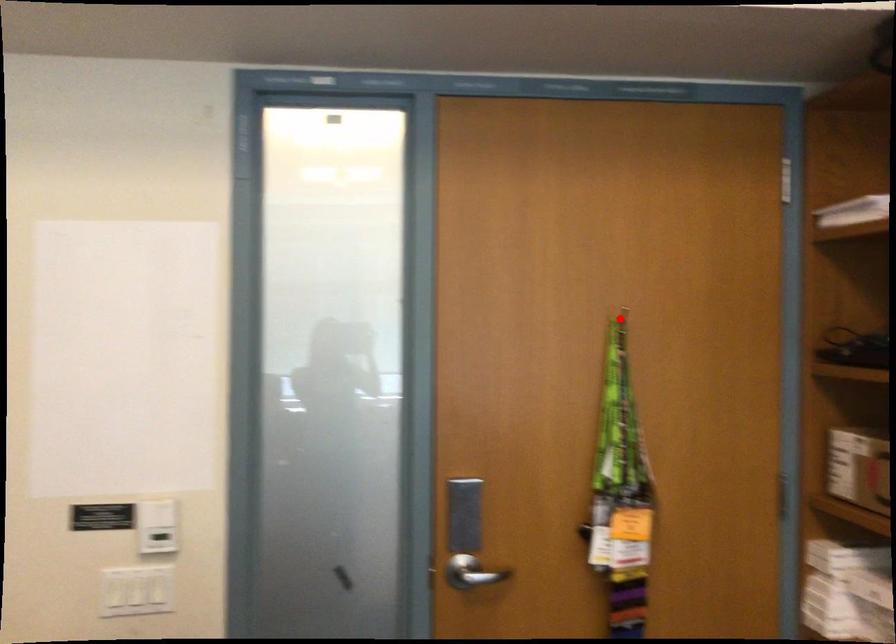
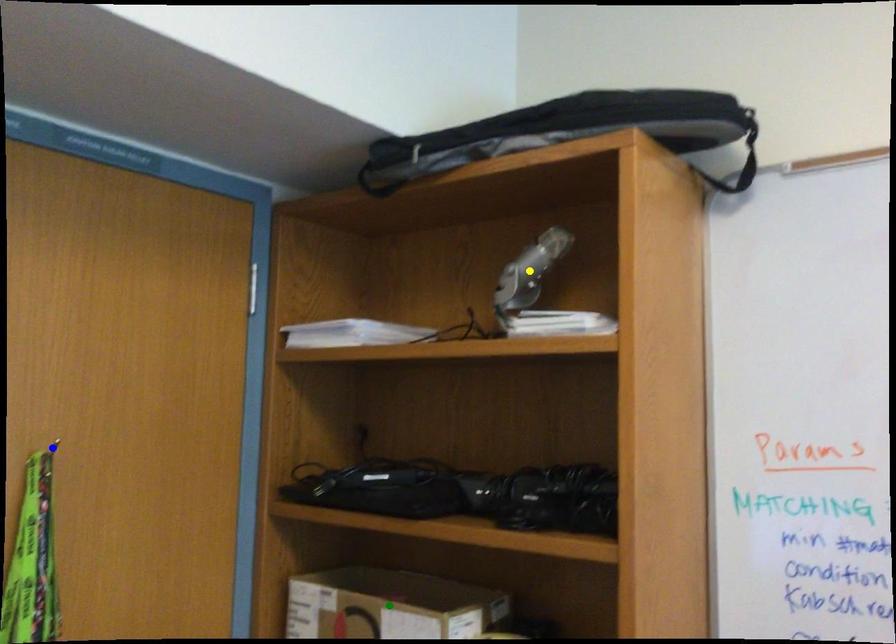
Question: I am providing you with two images of the same scene from different viewpoints. A red point is marked on the first image. You are given multiple points on the second image. In image 2, which mark is for the same physical point as the one in image 1?

Choices:
 (A) blue point
 (B) yellow point
 (C) green point

Answer: (A)